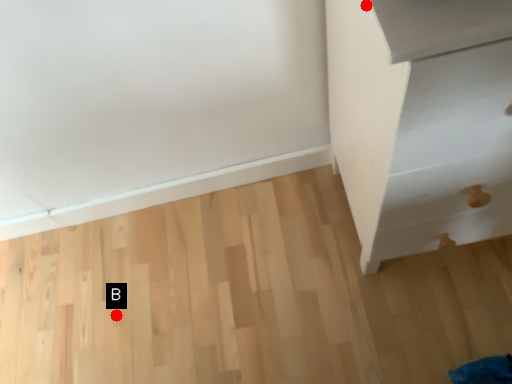
Question: Two points are circled on the image, labeled by A and B beside each circle. Which point is farther to the camera?

Choices:
 (A) A is further
 (B) B is further

Answer: (B)